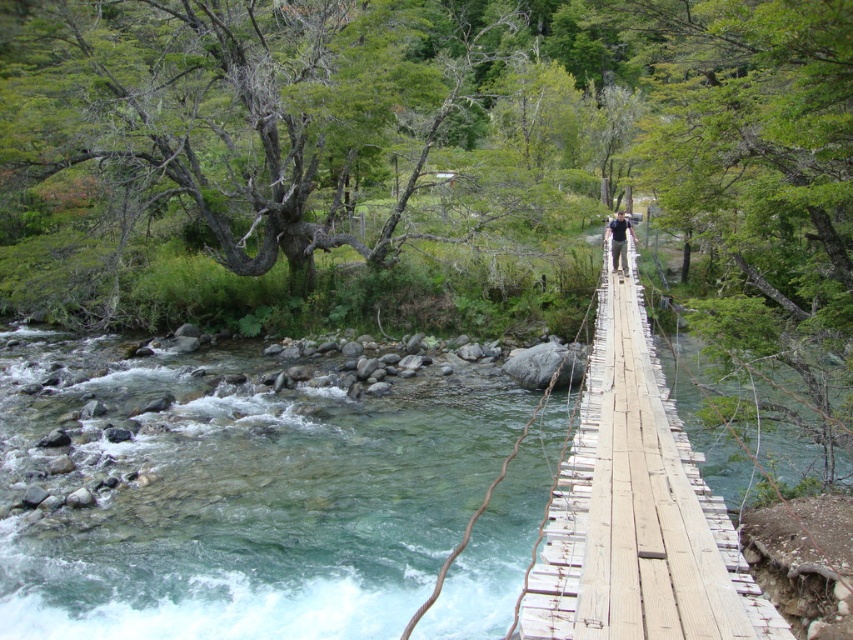
You are standing on the riverbank and want to cross the river using the light brown wooden bridge at center. However, you notice a person wearing the dark blue shirt at center walking on the bridge. Based on their height compared to the bridge, do you think the bridge can safely support your weight?

The light brown wooden bridge at center is much taller than the dark blue shirt at center, indicating that the bridge is structurally sound and capable of supporting the person walking on it. Therefore, it should be safe for you to cross the light brown wooden bridge at center as well.

You are a hiker carrying a backpack that is 2.5 meters wide. You come across the light brown wooden bridge at center. Can your backpack fit through the bridge without touching the sides?

The light brown wooden bridge at center is 3.35 meters wide, so yes, the backpack can fit through the bridge without touching the sides since it is narrower than the bridge.